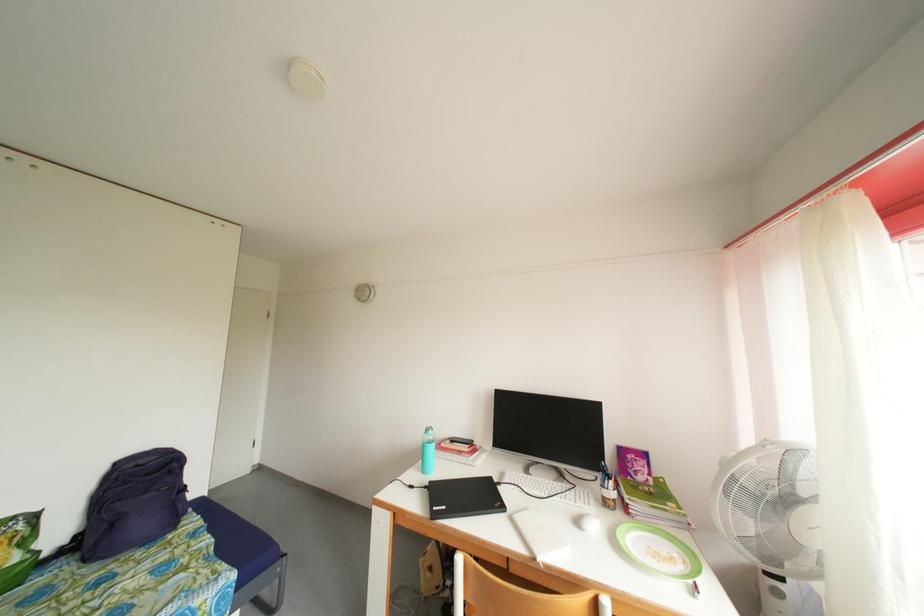
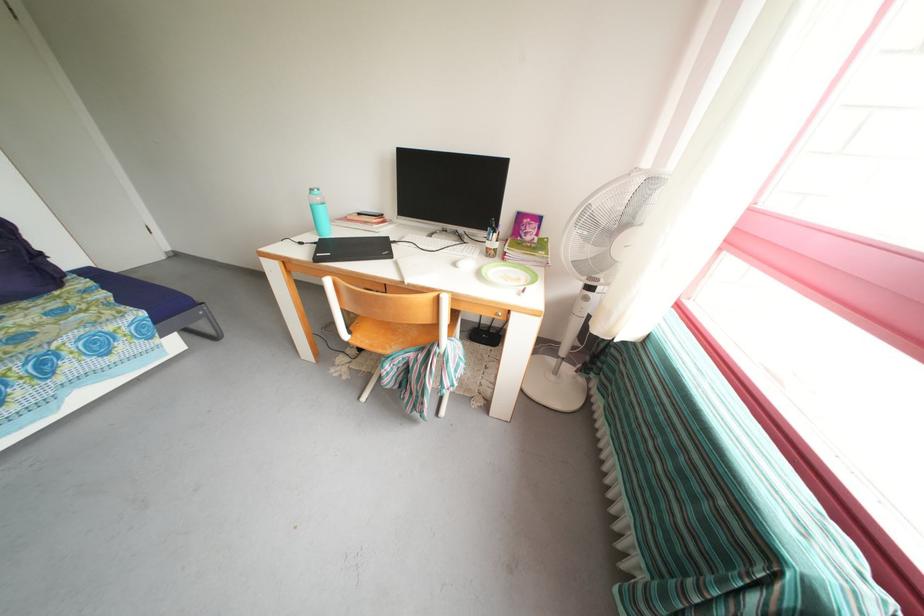
Locate, in the second image, the point that corresponds to [432,493] in the first image.

(322, 249)